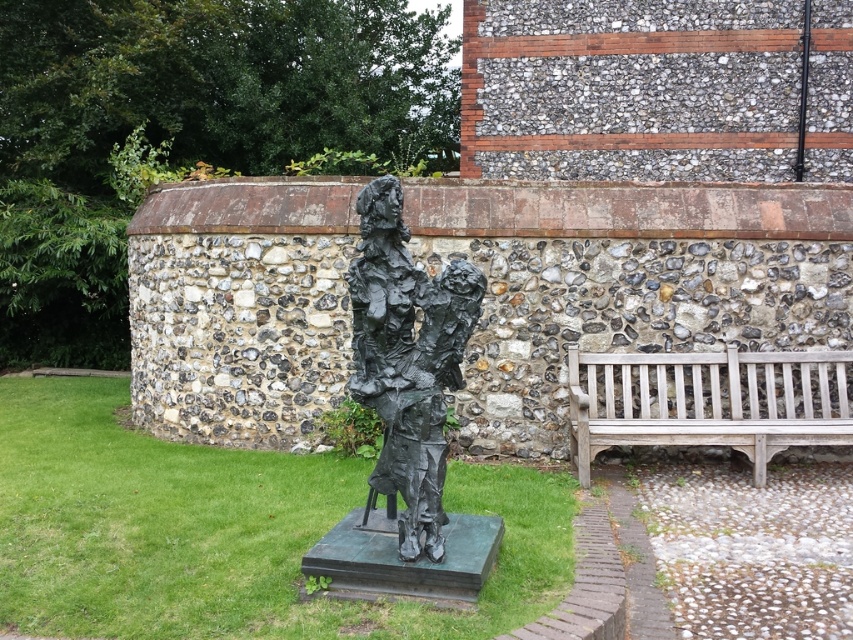
Question: Which point is closer to the camera taking this photo?

Choices:
 (A) (723, 417)
 (B) (418, 380)

Answer: (B)

Question: Is bronze statue at center above wooden bench at right?

Choices:
 (A) yes
 (B) no

Answer: (A)

Question: Is bronze statue at center behind wooden bench at right?

Choices:
 (A) yes
 (B) no

Answer: (B)

Question: Which point is closer to the camera?

Choices:
 (A) (430, 349)
 (B) (611, 385)

Answer: (A)

Question: Does bronze statue at center lie behind wooden bench at right?

Choices:
 (A) yes
 (B) no

Answer: (B)

Question: Which of the following is the farthest from the observer?

Choices:
 (A) wooden bench at right
 (B) bronze statue at center

Answer: (A)